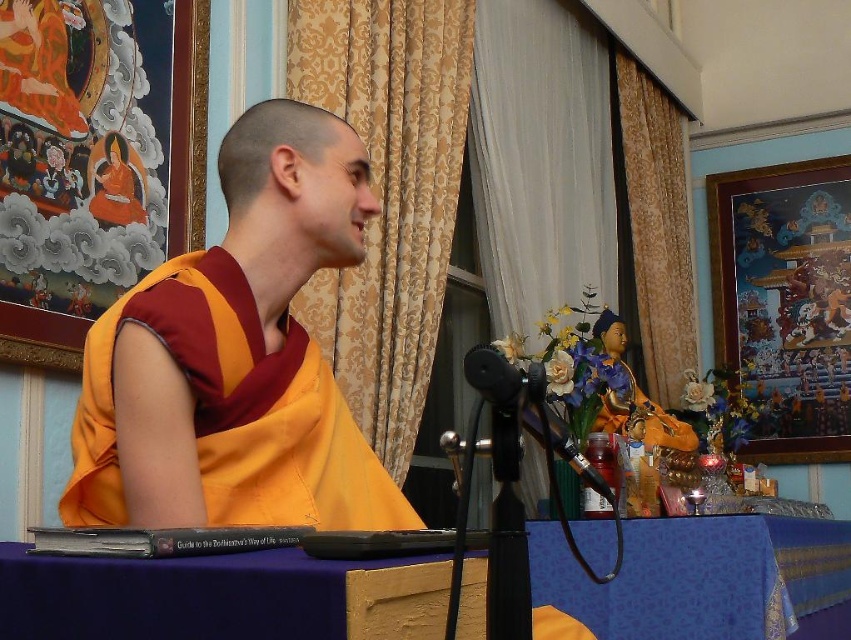
You are a photographer setting up for a religious ceremony. You need to ensure the yellow silk robe at center is visible in the photo without being blocked by the purple fabric table at lower center. Based on the scene description, can you confirm if the robe is positioned in a way that it won

The yellow silk robe at center is in front of the purple fabric table at lower center, so the robe will not be blocked by the table and will be visible in the photo.

You are a photographer standing 2 meters away from the yellow silk robe at center and purple fabric table at lower center. You want to take a photo of both objects in the same frame. Considering the distance between them, will you need to zoom out your camera lens to ensure both are fully visible?

The yellow silk robe at center is 1.47 meters away from the purple fabric table at lower center. Since you are standing 2 meters away from both objects, the distance between them is less than your distance from them, so you can capture both in the same frame without needing to zoom out.

You are a photographer setting up for a religious ceremony. You need to ensure that the yellow silk robe at center and the purple fabric table at lower center are both visible in the frame. Based on their positions, which object should you focus on first to capture both in the shot?

The yellow silk robe at center is located above the purple fabric table at lower center, so focusing on the yellow silk robe at center first will ensure both are visible in the frame.